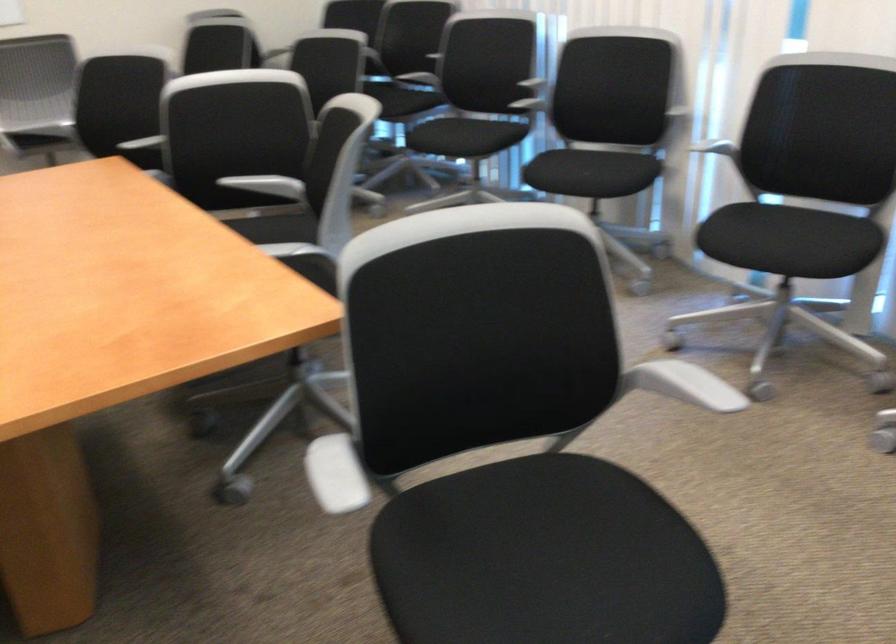
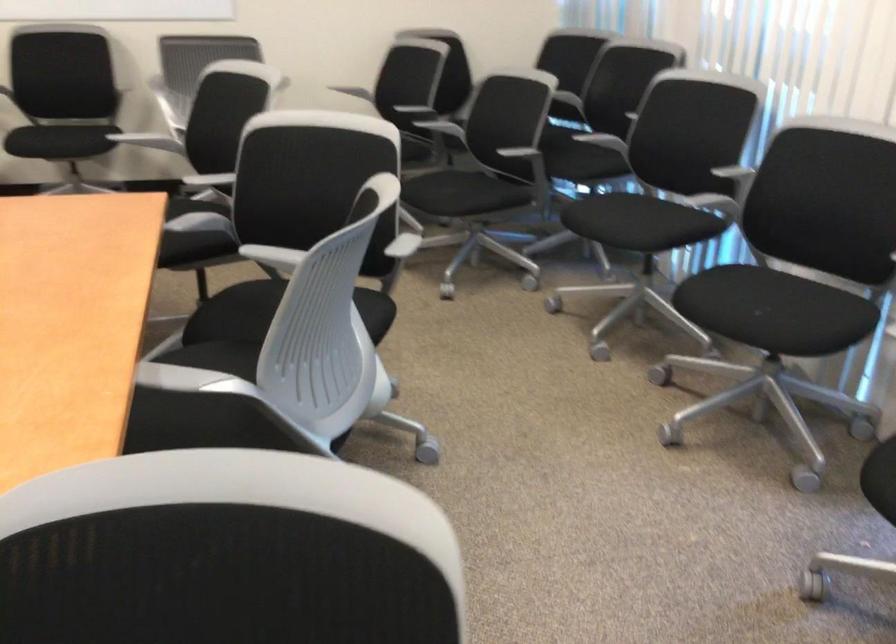
Question: How did the camera likely rotate?

Choices:
 (A) Left
 (B) Right
 (C) Up
 (D) Down

Answer: (A)